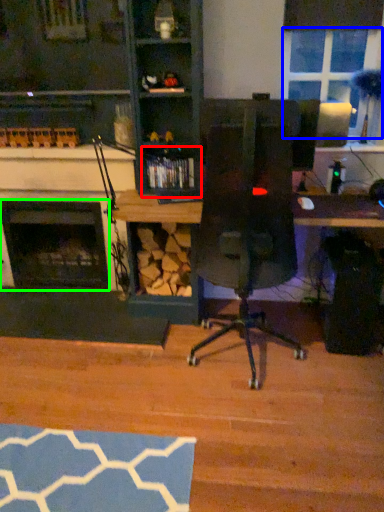
Question: Which is farther away from shelf (highlighted by a red box)? window screen (highlighted by a blue box) or fireplace (highlighted by a green box)?

Choices:
 (A) window screen
 (B) fireplace

Answer: (A)